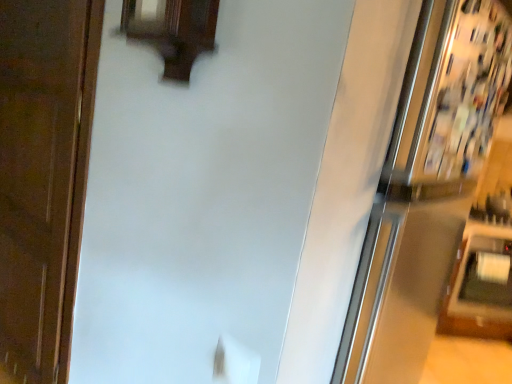
Question: Is brown wood door at left inside white glossy fridge at upper right?

Choices:
 (A) no
 (B) yes

Answer: (A)

Question: From the image's perspective, is white glossy fridge at upper right beneath brown wood door at left?

Choices:
 (A) yes
 (B) no

Answer: (A)

Question: Is white glossy fridge at upper right turned away from brown wood door at left?

Choices:
 (A) no
 (B) yes

Answer: (A)

Question: Is white glossy fridge at upper right not near brown wood door at left?

Choices:
 (A) no
 (B) yes

Answer: (B)

Question: Can we say white glossy fridge at upper right lies outside brown wood door at left?

Choices:
 (A) yes
 (B) no

Answer: (A)

Question: From the image's perspective, is white glossy fridge at upper right above brown wood door at left?

Choices:
 (A) yes
 (B) no

Answer: (B)

Question: Is brown wood door at left to the right of white glossy fridge at upper right from the viewer's perspective?

Choices:
 (A) yes
 (B) no

Answer: (B)

Question: Does brown wood door at left have a greater width compared to white glossy fridge at upper right?

Choices:
 (A) no
 (B) yes

Answer: (A)

Question: From a real-world perspective, is brown wood door at left below white glossy fridge at upper right?

Choices:
 (A) no
 (B) yes

Answer: (B)

Question: Is brown wood door at left to the left of white glossy fridge at upper right from the viewer's perspective?

Choices:
 (A) no
 (B) yes

Answer: (B)

Question: From a real-world perspective, is brown wood door at left over white glossy fridge at upper right?

Choices:
 (A) yes
 (B) no

Answer: (B)

Question: From the image's perspective, is brown wood door at left located above white glossy fridge at upper right?

Choices:
 (A) no
 (B) yes

Answer: (B)

Question: Choose the correct answer: Is brown wood door at left inside white glossy fridge at upper right or outside it?

Choices:
 (A) inside
 (B) outside

Answer: (B)